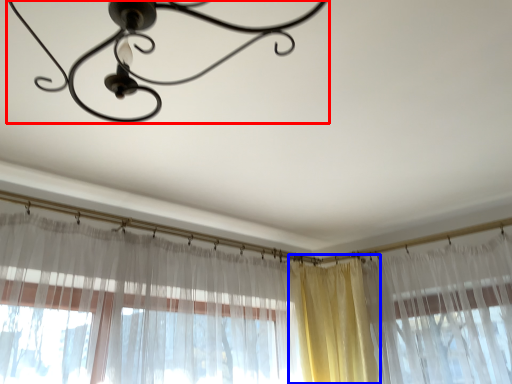
Question: Which point is further to the camera, lamp (highlighted by a red box) or curtain (highlighted by a blue box)?

Choices:
 (A) lamp
 (B) curtain

Answer: (B)